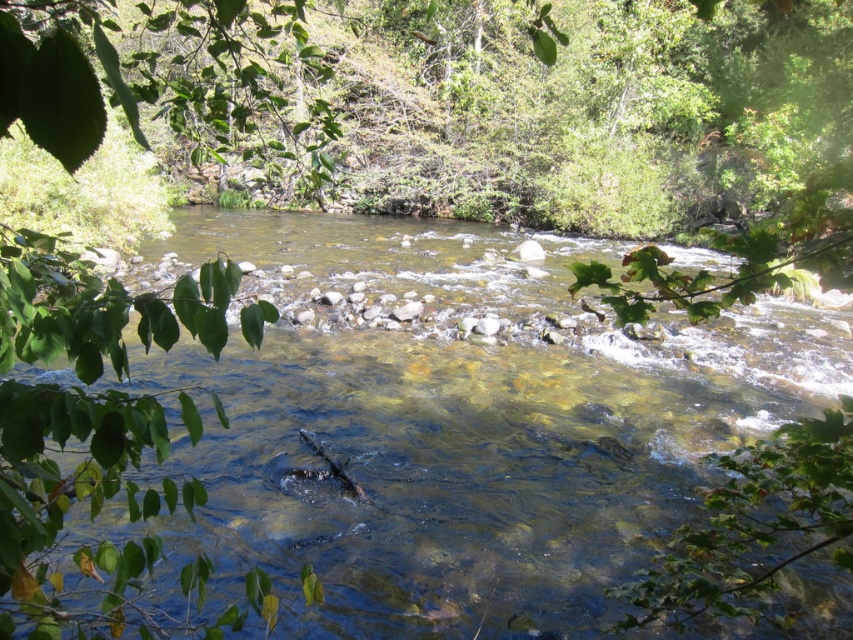
You are standing at the edge of the river and want to place a small floating toy between the clear water at center and the green leafy branch at left. If the toy is 1 meter long, will it fit between them without overlapping either?

The clear water at center is 8.18 meters away from the green leafy branch at left. Since the distance between them is greater than the toy length of 1 meter, the toy can fit between them without overlapping.